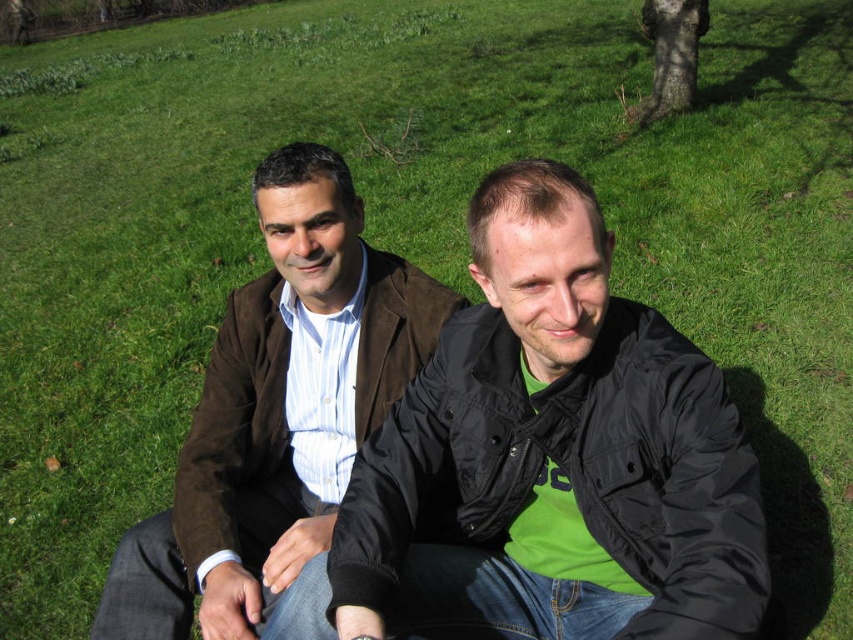
You are trying to decide which jacket to wear for a casual day out. You see both the matte black jacket at center and the brown suede jacket at center in the image. Which jacket is positioned higher on the person?

The matte black jacket at center is located above the brown suede jacket at center, so it is positioned higher on the person.

You are a photographer standing in front of the two jackets in the image. You want to take a closeup shot of the matte black jacket at center without including the brown suede jacket at center in the frame. Is this possible given their positions?

The matte black jacket at center is closer to the viewer than the brown suede jacket at center, so yes, you can take a closeup shot of the matte black jacket at center without including the brown suede jacket at center by focusing on the closer jacket and adjusting the camera angle or zoom to exclude the farther one.